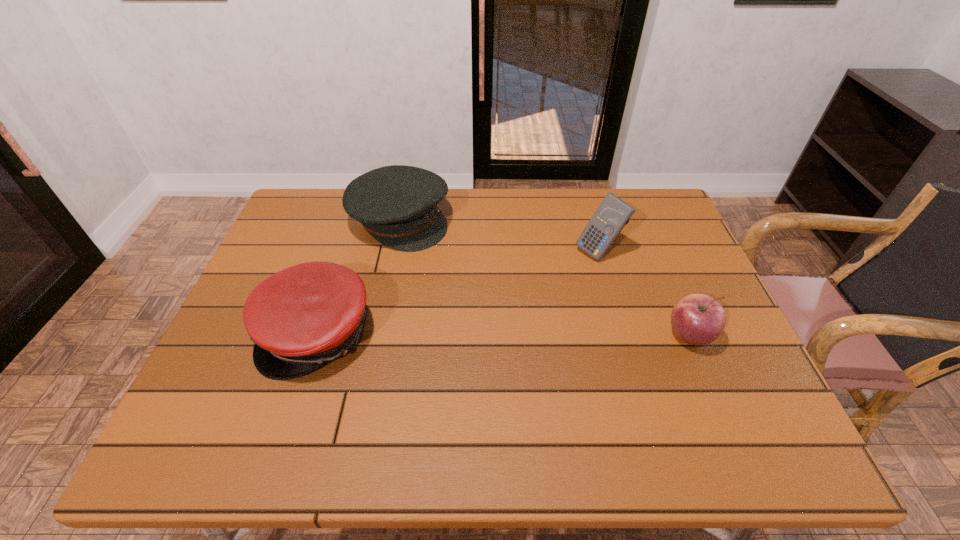
Locate an element on the screen. This screenshot has height=540, width=960. vacant region located on the front-facing side of the calculator is located at coordinates (545, 282).

Where is `blank area located 0.130m on the front-facing side of the calculator`? The height and width of the screenshot is (540, 960). blank area located 0.130m on the front-facing side of the calculator is located at coordinates (550, 279).

At what (x,y) coordinates should I click in order to perform the action: click on free space located on the front-facing side of the calculator. Please return your answer as a coordinate pair (x, y). The image size is (960, 540). Looking at the image, I should click on (542, 284).

Identify the location of object located in the far edge section of the desktop. Image resolution: width=960 pixels, height=540 pixels. (397, 205).

Locate an element on the screen. The image size is (960, 540). object present at the near edge is located at coordinates (300, 318).

Identify the location of object present at the left edge. (300, 318).

Find the location of a particular element. Image resolution: width=960 pixels, height=540 pixels. object that is at the right edge is located at coordinates (697, 319).

Image resolution: width=960 pixels, height=540 pixels. I want to click on object that is at the near left corner, so click(300, 318).

Identify the location of vacant region at the far edge. (585, 221).

The image size is (960, 540). Identify the location of vacant space at the near edge. (283, 382).